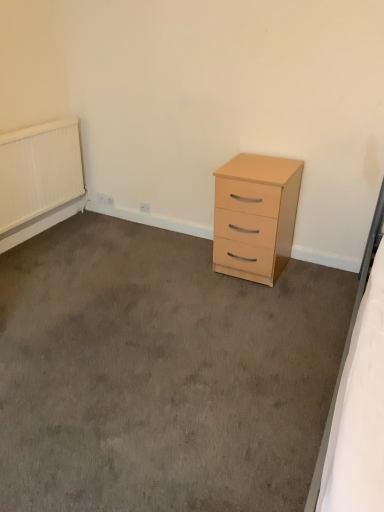
Locate an element on the screen. This screenshot has height=512, width=384. white textured radiator at upper left is located at coordinates (39, 170).

What do you see at coordinates (39, 170) in the screenshot? I see `white textured radiator at upper left` at bounding box center [39, 170].

Describe the element at coordinates (255, 216) in the screenshot. I see `light wood/finish chest of drawers at center-right` at that location.

Measure the distance between light wood/finish chest of drawers at center-right and camera.

light wood/finish chest of drawers at center-right is 2.22 meters away from camera.

Locate an element on the screen. light wood/finish chest of drawers at center-right is located at coordinates (255, 216).

What is the approximate height of light wood/finish chest of drawers at center-right?

light wood/finish chest of drawers at center-right is 26.50 inches in height.

This screenshot has height=512, width=384. Find the location of `white textured radiator at upper left`. white textured radiator at upper left is located at coordinates (39, 170).

Looking at this image, in the image, is white textured radiator at upper left on the left side or the right side of light wood/finish chest of drawers at center-right?

In the image, white textured radiator at upper left appears on the left side of light wood/finish chest of drawers at center-right.

Is white textured radiator at upper left closer to the viewer compared to light wood/finish chest of drawers at center-right?

No, white textured radiator at upper left is further to the viewer.

Is point (38, 186) positioned in front of point (280, 231)?

No, (38, 186) is further to viewer.

From the image's perspective, which one is positioned higher, white textured radiator at upper left or light wood/finish chest of drawers at center-right?

white textured radiator at upper left, from the image's perspective.

From the picture: From a real-world perspective, which object stands above the other?

white textured radiator at upper left.

Which object is thinner, white textured radiator at upper left or light wood/finish chest of drawers at center-right?

white textured radiator at upper left is thinner.

Is white textured radiator at upper left taller than light wood/finish chest of drawers at center-right?

Incorrect, the height of white textured radiator at upper left is not larger of that of light wood/finish chest of drawers at center-right.

Who is bigger, white textured radiator at upper left or light wood/finish chest of drawers at center-right?

Bigger between the two is light wood/finish chest of drawers at center-right.

Is white textured radiator at upper left surrounding light wood/finish chest of drawers at center-right?

No, white textured radiator at upper left does not contain light wood/finish chest of drawers at center-right.

Is white textured radiator at upper left next to light wood/finish chest of drawers at center-right?

No, white textured radiator at upper left is not touching light wood/finish chest of drawers at center-right.

Could you tell me if white textured radiator at upper left is turned towards light wood/finish chest of drawers at center-right?

Yes, white textured radiator at upper left is aimed at light wood/finish chest of drawers at center-right.

How different are the orientations of white textured radiator at upper left and light wood/finish chest of drawers at center-right in degrees?

90 degrees separate the facing orientations of white textured radiator at upper left and light wood/finish chest of drawers at center-right.

The height and width of the screenshot is (512, 384). Identify the location of chest of drawers on the right side of white textured radiator at upper left. (255, 216).

Consider the image. Between light wood/finish chest of drawers at center-right and white textured radiator at upper left, which one appears on the right side from the viewer's perspective?

light wood/finish chest of drawers at center-right is more to the right.

Considering the relative positions of light wood/finish chest of drawers at center-right and white textured radiator at upper left in the image provided, is light wood/finish chest of drawers at center-right in front of white textured radiator at upper left?

Yes.

Does point (285, 256) lie behind point (9, 208)?

No.

From the image's perspective, would you say light wood/finish chest of drawers at center-right is positioned over white textured radiator at upper left?

No, from the image's perspective, light wood/finish chest of drawers at center-right is not over white textured radiator at upper left.

Based on the photo, from a real-world perspective, who is located higher, light wood/finish chest of drawers at center-right or white textured radiator at upper left?

white textured radiator at upper left is physically above.

Which of these two, light wood/finish chest of drawers at center-right or white textured radiator at upper left, is wider?

Wider between the two is light wood/finish chest of drawers at center-right.

Considering the sizes of light wood/finish chest of drawers at center-right and white textured radiator at upper left in the image, is light wood/finish chest of drawers at center-right taller or shorter than white textured radiator at upper left?

Considering their sizes, light wood/finish chest of drawers at center-right has more height than white textured radiator at upper left.

Between light wood/finish chest of drawers at center-right and white textured radiator at upper left, which one has smaller size?

white textured radiator at upper left.

Is white textured radiator at upper left located within light wood/finish chest of drawers at center-right?

That's incorrect, white textured radiator at upper left is not inside light wood/finish chest of drawers at center-right.

Is the surface of light wood/finish chest of drawers at center-right in direct contact with white textured radiator at upper left?

light wood/finish chest of drawers at center-right and white textured radiator at upper left are not in contact.

Could you tell me if light wood/finish chest of drawers at center-right is facing white textured radiator at upper left?

No, light wood/finish chest of drawers at center-right is not oriented towards white textured radiator at upper left.

You are a GUI agent. You are given a task and a screenshot of the screen. Output one action in this format:
    pyautogui.click(x=<x>, y=<y>)
    Task: Click on the chest of drawers in front of the white textured radiator at upper left
    
    Given the screenshot: What is the action you would take?
    pyautogui.click(x=255, y=216)

This screenshot has height=512, width=384. What are the coordinates of `radiator lying on the left of light wood/finish chest of drawers at center-right` in the screenshot? It's located at point(39,170).

Locate an element on the screen. chest of drawers that appears on the right of white textured radiator at upper left is located at coordinates (255, 216).